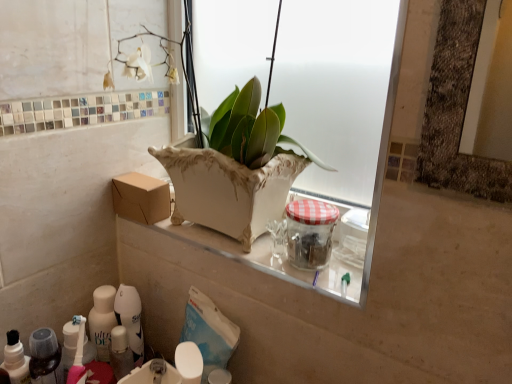
Question: Could you tell me if clear glass jar with red checkered lid at center is facing white glossy toothpaste tube at lower left?

Choices:
 (A) yes
 (B) no

Answer: (B)

Question: Is white glossy toothpaste tube at lower left at the back of clear glass jar with red checkered lid at center?

Choices:
 (A) no
 (B) yes

Answer: (A)

Question: From the image's perspective, is clear glass jar with red checkered lid at center on top of white glossy toothpaste tube at lower left?

Choices:
 (A) yes
 (B) no

Answer: (A)

Question: Is clear glass jar with red checkered lid at center directly adjacent to white glossy toothpaste tube at lower left?

Choices:
 (A) no
 (B) yes

Answer: (A)

Question: Is clear glass jar with red checkered lid at center to the right of white glossy toothpaste tube at lower left from the viewer's perspective?

Choices:
 (A) no
 (B) yes

Answer: (B)

Question: Considering the relative sizes of clear glass jar with red checkered lid at center and white glossy toothpaste tube at lower left in the image provided, is clear glass jar with red checkered lid at center shorter than white glossy toothpaste tube at lower left?

Choices:
 (A) yes
 (B) no

Answer: (A)

Question: Can you confirm if brown cardboard box at center is positioned to the left of white glossy sink at lower center?

Choices:
 (A) no
 (B) yes

Answer: (B)

Question: Does brown cardboard box at center contain white glossy sink at lower center?

Choices:
 (A) yes
 (B) no

Answer: (B)

Question: Is white glossy sink at lower center at the back of brown cardboard box at center?

Choices:
 (A) yes
 (B) no

Answer: (B)

Question: Does brown cardboard box at center appear on the right side of white glossy sink at lower center?

Choices:
 (A) no
 (B) yes

Answer: (A)

Question: Can you confirm if brown cardboard box at center is bigger than white glossy sink at lower center?

Choices:
 (A) yes
 (B) no

Answer: (A)

Question: Is brown cardboard box at center oriented towards white glossy sink at lower center?

Choices:
 (A) no
 (B) yes

Answer: (A)

Question: Considering the relative sizes of white glossy sink at lower center and clear glass jar with red checkered lid at center in the image provided, is white glossy sink at lower center wider than clear glass jar with red checkered lid at center?

Choices:
 (A) yes
 (B) no

Answer: (A)